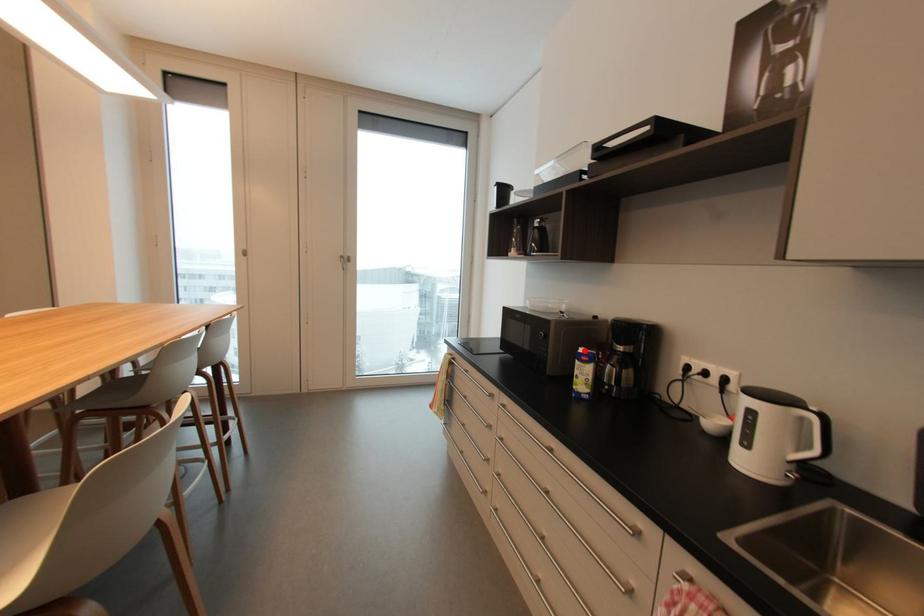
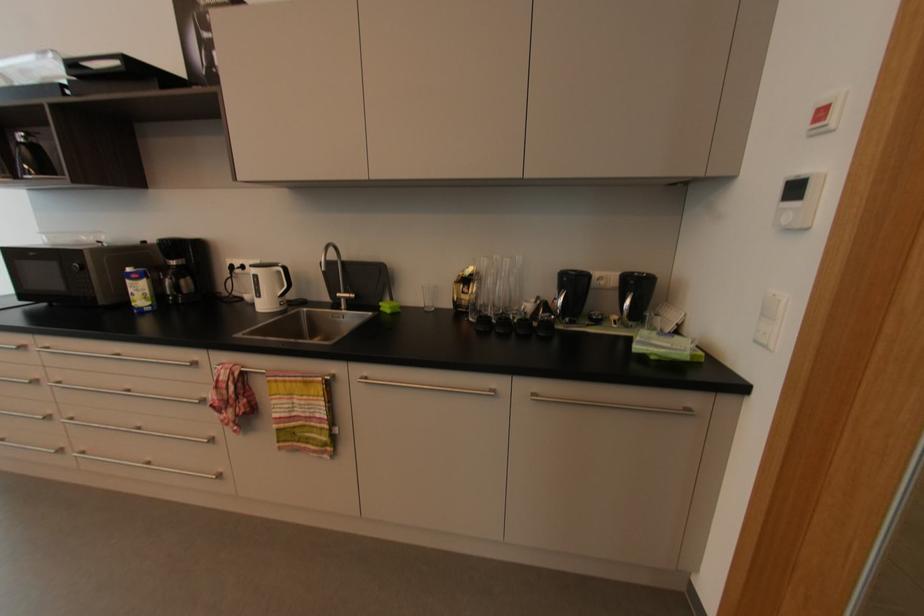
The point at the highlighted location is marked in the first image. Where is the corresponding point in the second image?

(131, 270)